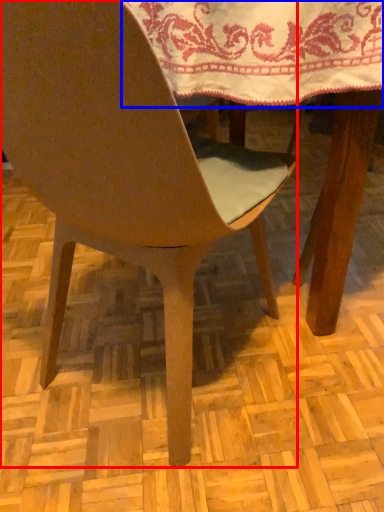
Question: Among these objects, which one is farthest to the camera, chair (highlighted by a red box) or tablecloth (highlighted by a blue box)?

Choices:
 (A) chair
 (B) tablecloth

Answer: (B)